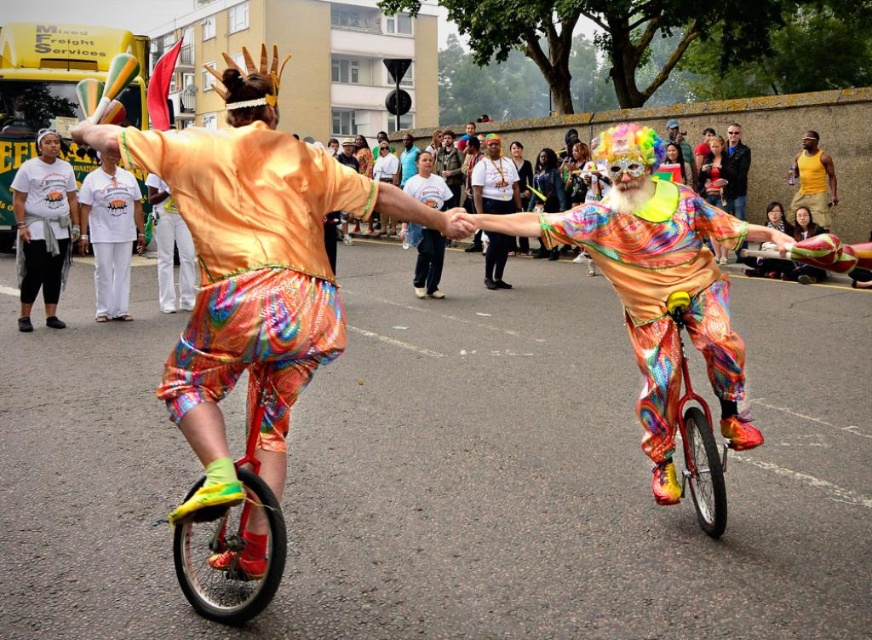
Does red matte unicycle at center have a larger size compared to white t-shirt at left?

Actually, red matte unicycle at center might be smaller than white t-shirt at left.

Does red matte unicycle at center appear on the right side of white t-shirt at left?

Yes, red matte unicycle at center is to the right of white t-shirt at left.

Where is `red matte unicycle at center`? The width and height of the screenshot is (872, 640). red matte unicycle at center is located at coordinates (235, 532).

Does white cotton shirt at center come in front of red metallic unicycle at center?

That is False.

Does white cotton shirt at center have a greater width compared to red metallic unicycle at center?

Indeed, white cotton shirt at center has a greater width compared to red metallic unicycle at center.

Is point (92, 211) positioned before point (702, 401)?

No, it is not.

You are a GUI agent. You are given a task and a screenshot of the screen. Output one action in this format:
    pyautogui.click(x=<x>, y=<y>)
    Task: Click on the white cotton shirt at center
    
    Given the screenshot: What is the action you would take?
    pyautogui.click(x=110, y=234)

Does white t-shirt at left have a larger size compared to white cotton shirt at center?

No, white t-shirt at left is not bigger than white cotton shirt at center.

Looking at this image, can you confirm if white t-shirt at left is positioned below white cotton shirt at center?

Actually, white t-shirt at left is above white cotton shirt at center.

This screenshot has width=872, height=640. In order to click on white t-shirt at left in this screenshot , I will do `click(43, 227)`.